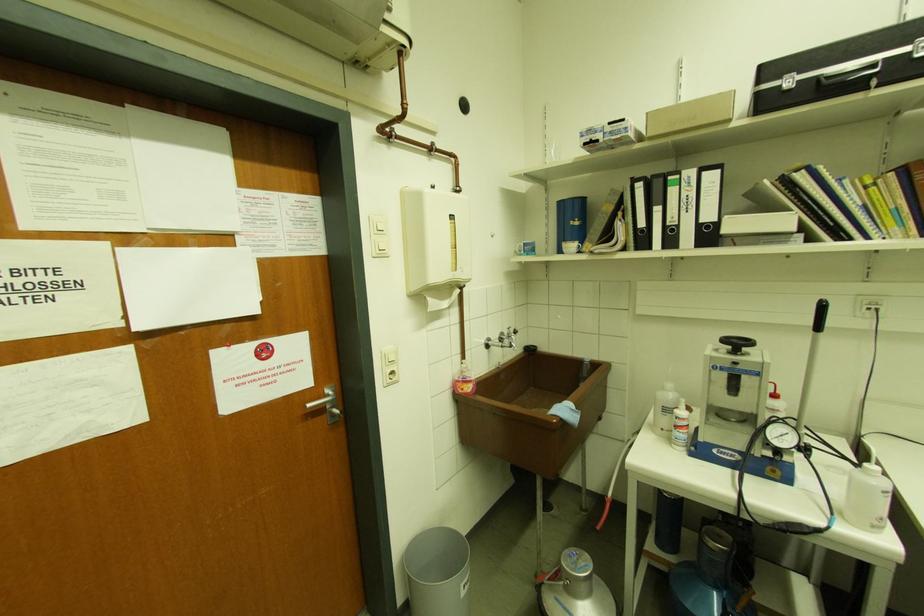
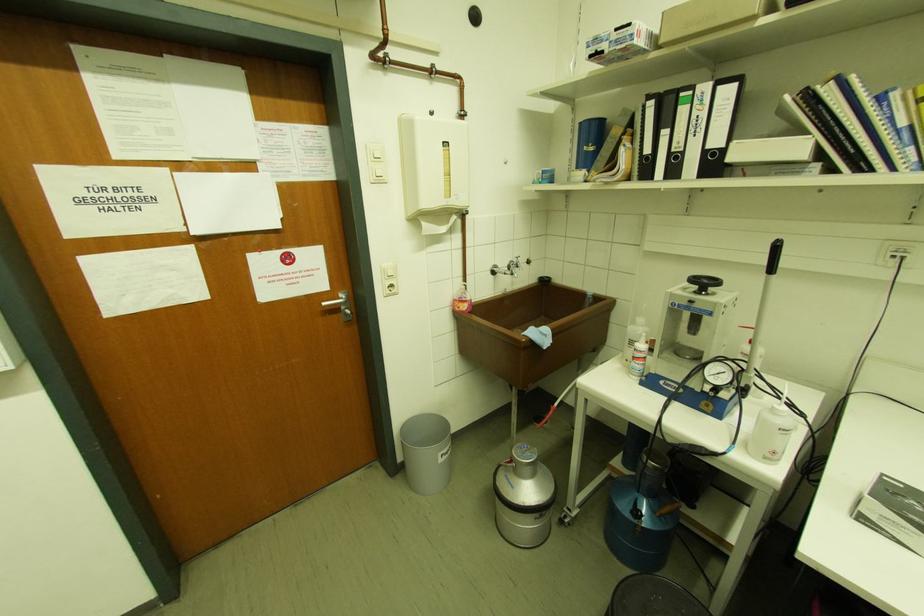
Find the pixel in the second image that matches the point at 712,217 in the first image.

(720, 143)